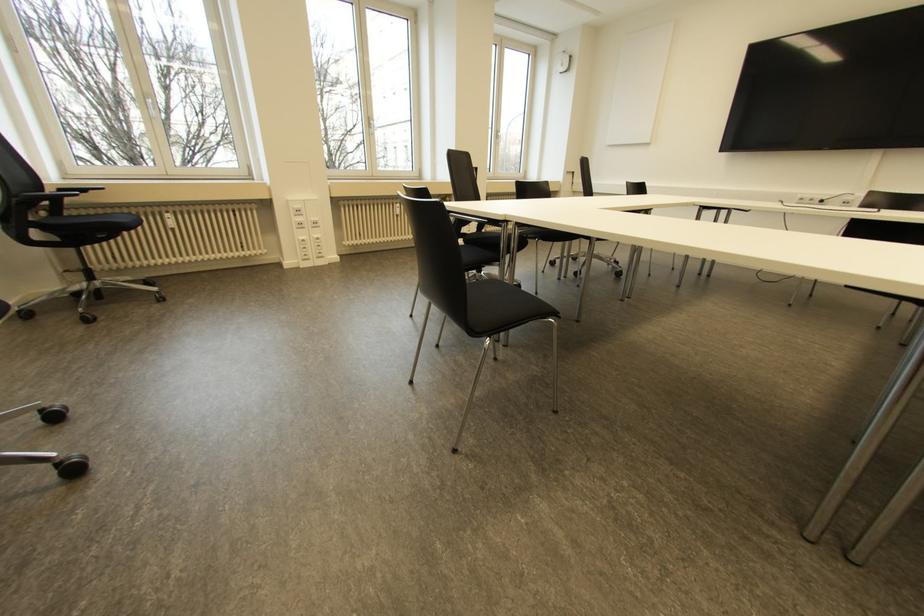
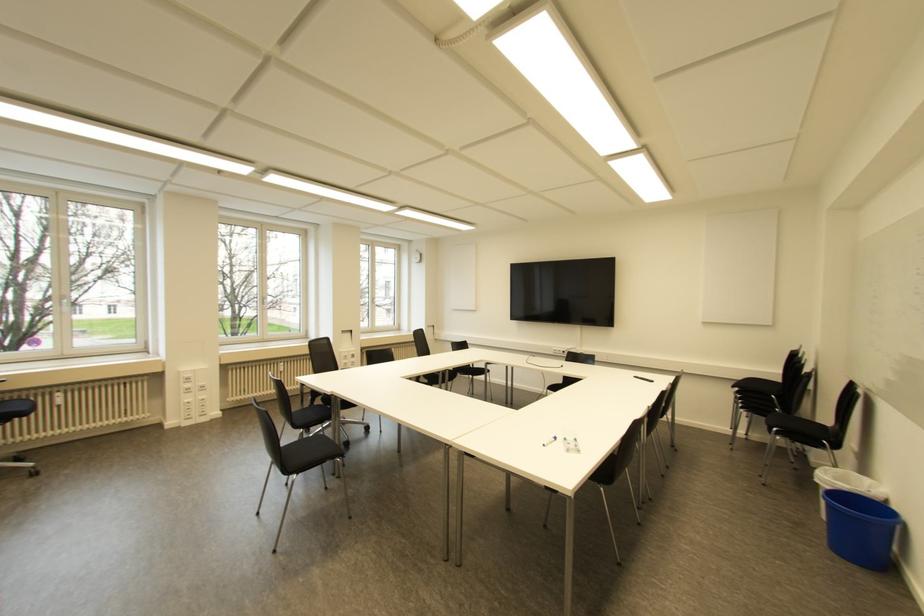
The point at [496,131] is marked in the first image. Where is the corresponding point in the second image?

(372, 299)